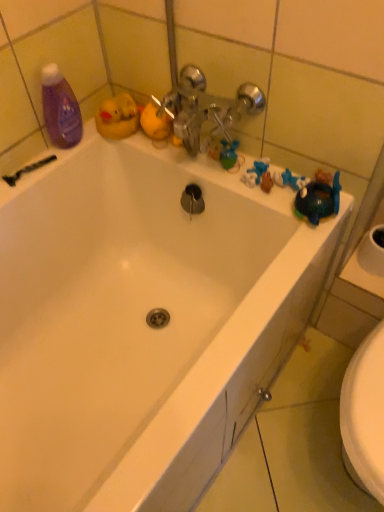
The width and height of the screenshot is (384, 512). What are the coordinates of `free spot in front of purple glossy bottle at upper left` in the screenshot? It's located at (39, 172).